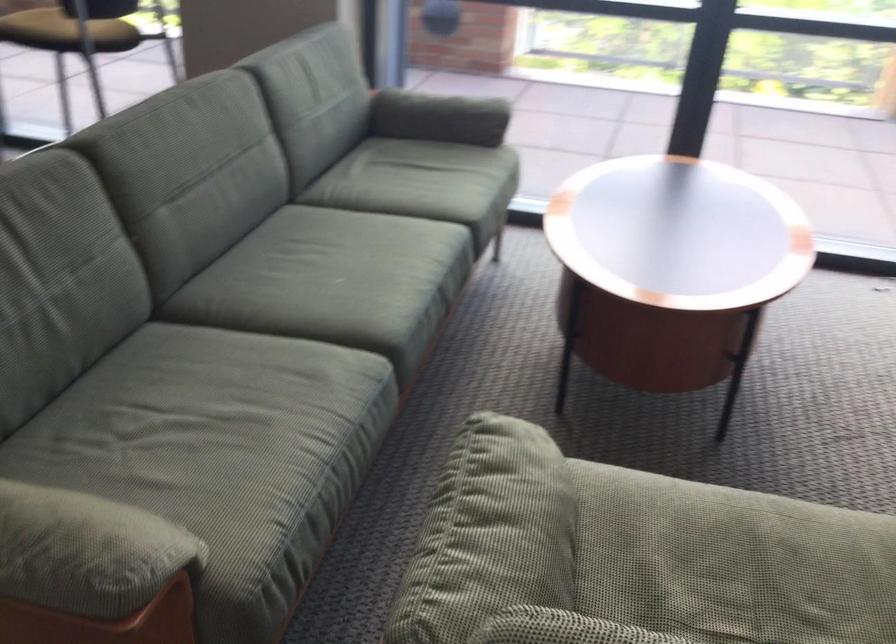
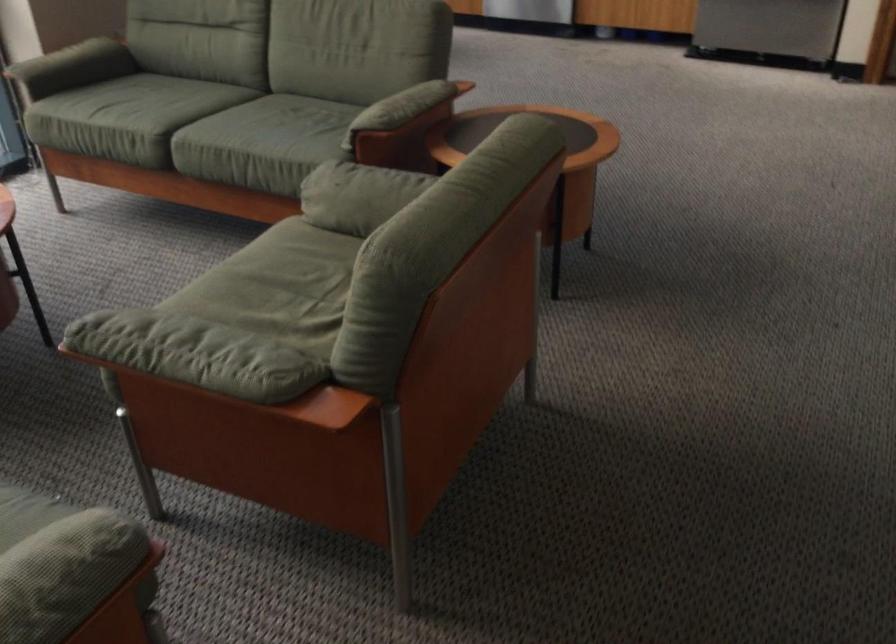
In the second image, find the point that corresponds to (435,532) in the first image.

(195, 354)